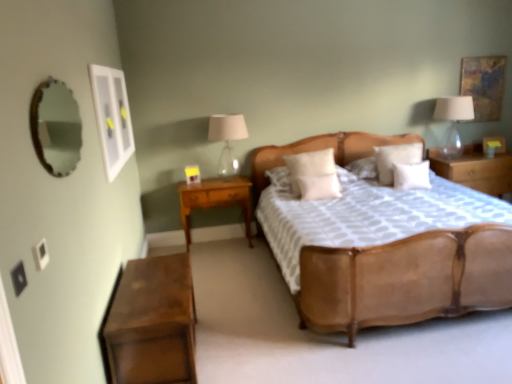
I want to click on empty space that is ontop of light wood/wooden nightstand at lower left, the 2th nightstand viewed from the front (from a real-world perspective), so click(x=217, y=179).